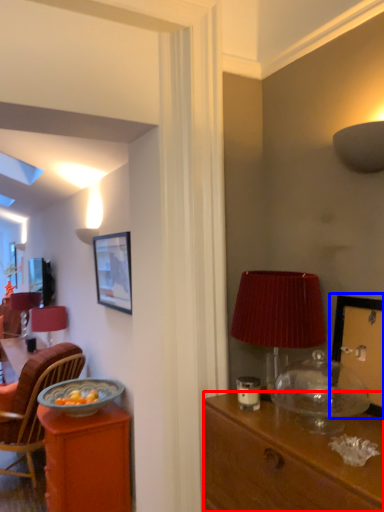
Question: Which object is further to the camera taking this photo, desk (highlighted by a red box) or picture frame (highlighted by a blue box)?

Choices:
 (A) desk
 (B) picture frame

Answer: (B)